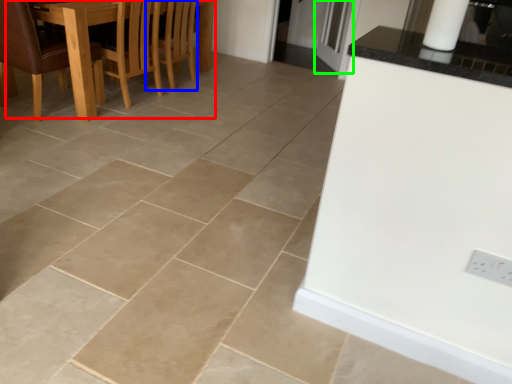
Question: Which object is positioned farthest from kitchen & dining room table (highlighted by a red box)? Select from armchair (highlighted by a blue box) and glass door (highlighted by a green box).

Choices:
 (A) armchair
 (B) glass door

Answer: (B)